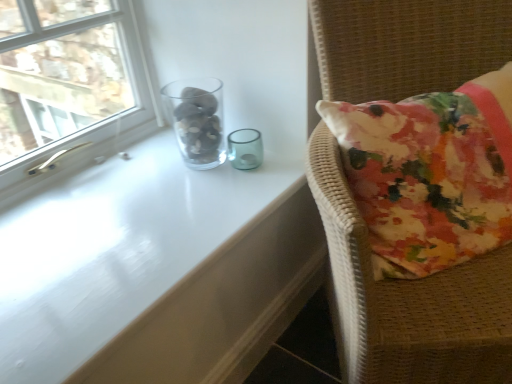
Find the location of a particular element. vacant space in front of transparent glass vase at upper left is located at coordinates point(200,195).